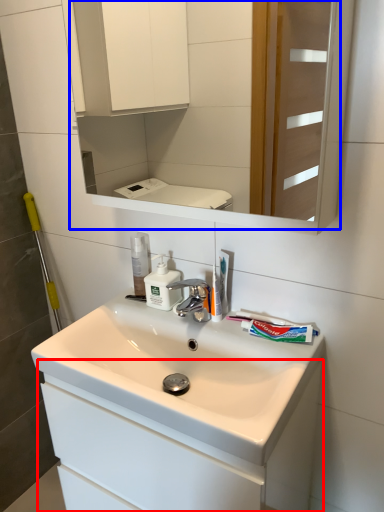
Question: Which of the following is the closest to the observer, bathroom cabinet (highlighted by a red box) or mirror (highlighted by a blue box)?

Choices:
 (A) bathroom cabinet
 (B) mirror

Answer: (B)